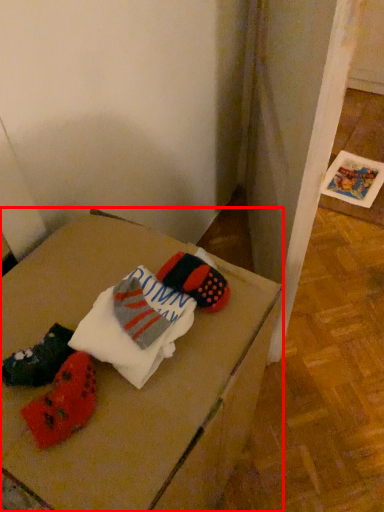
Question: From the image's perspective, where is furniture (annotated by the red box) located relative to sheet?

Choices:
 (A) below
 (B) above

Answer: (A)